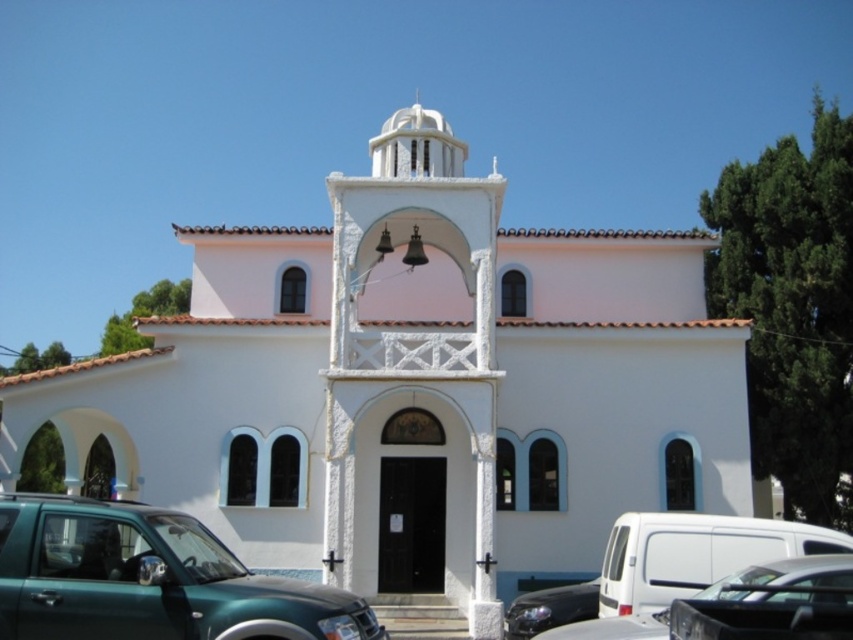
Question: Which point is farther to the camera?

Choices:
 (A) black glossy car at lower right
 (B) white stone bell tower at center

Answer: (B)

Question: Which point is farther to the camera?

Choices:
 (A) (770, 600)
 (B) (410, 108)
 (C) (231, 602)

Answer: (B)

Question: Does white stone bell tower at center appear under black glossy car at lower right?

Choices:
 (A) no
 (B) yes

Answer: (A)

Question: Is white stone bell tower at center positioned at the back of black glossy car at lower right?

Choices:
 (A) yes
 (B) no

Answer: (A)

Question: Which point is farther to the camera?

Choices:
 (A) green matte truck at lower left
 (B) white stone bell tower at center

Answer: (B)

Question: Can you confirm if white stone bell tower at center is positioned to the left of green matte truck at lower left?

Choices:
 (A) no
 (B) yes

Answer: (A)